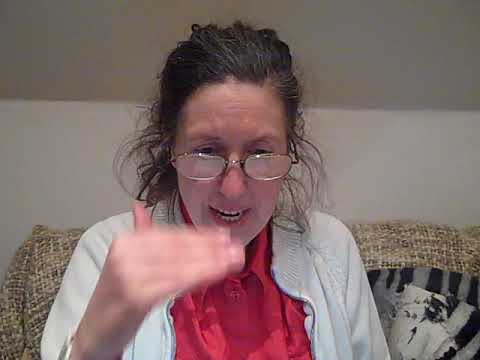
The height and width of the screenshot is (360, 480). What are the coordinates of `beige wall` in the screenshot? It's located at (417, 194).